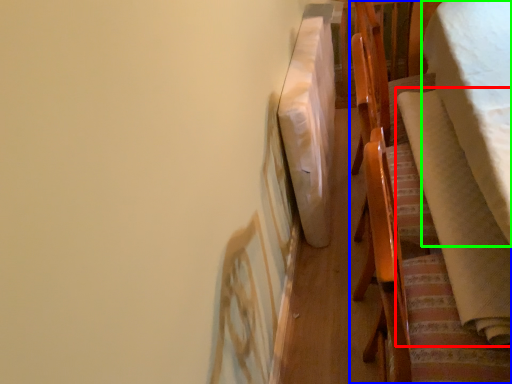
Question: Based on their relative distances, which object is nearer to blanket (highlighted by a red box)? Choose from furniture (highlighted by a blue box) and blanket (highlighted by a green box).

Choices:
 (A) furniture
 (B) blanket

Answer: (A)